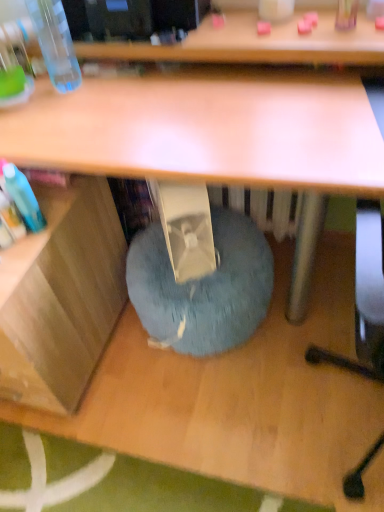
Question: Would you say transparent plastic bottle at upper left contains blue fuzzy bean bag at lower center?

Choices:
 (A) yes
 (B) no

Answer: (B)

Question: Is transparent plastic bottle at upper left positioned behind blue fuzzy bean bag at lower center?

Choices:
 (A) yes
 (B) no

Answer: (B)

Question: From a real-world perspective, is transparent plastic bottle at upper left over blue fuzzy bean bag at lower center?

Choices:
 (A) yes
 (B) no

Answer: (A)

Question: Is transparent plastic bottle at upper left positioned beyond the bounds of blue fuzzy bean bag at lower center?

Choices:
 (A) no
 (B) yes

Answer: (B)

Question: Is transparent plastic bottle at upper left placed right next to blue fuzzy bean bag at lower center?

Choices:
 (A) yes
 (B) no

Answer: (B)

Question: Is transparent plastic bottle at upper left spatially inside blue fuzzy bean bag at lower center, or outside of it?

Choices:
 (A) outside
 (B) inside

Answer: (A)

Question: In terms of height, does transparent plastic bottle at upper left look taller or shorter compared to blue fuzzy bean bag at lower center?

Choices:
 (A) tall
 (B) short

Answer: (A)

Question: From the image's perspective, is transparent plastic bottle at upper left located above or below blue fuzzy bean bag at lower center?

Choices:
 (A) below
 (B) above

Answer: (B)

Question: Does point (77, 65) appear closer or farther from the camera than point (180, 309)?

Choices:
 (A) closer
 (B) farther

Answer: (A)

Question: From a real-world perspective, is blue fuzzy bean bag at lower center positioned above or below wooden at left?

Choices:
 (A) below
 (B) above

Answer: (A)

Question: In terms of width, does blue fuzzy bean bag at lower center look wider or thinner when compared to wooden at left?

Choices:
 (A) wide
 (B) thin

Answer: (B)

Question: Based on their positions, is blue fuzzy bean bag at lower center located to the left or right of wooden at left?

Choices:
 (A) left
 (B) right

Answer: (B)

Question: Considering the positions of point (165, 295) and point (112, 224), is point (165, 295) closer or farther from the camera than point (112, 224)?

Choices:
 (A) closer
 (B) farther

Answer: (A)

Question: Is wooden at left inside the boundaries of transparent plastic bottle at upper left, or outside?

Choices:
 (A) inside
 (B) outside

Answer: (B)

Question: Considering the positions of wooden at left and transparent plastic bottle at upper left in the image, is wooden at left wider or thinner than transparent plastic bottle at upper left?

Choices:
 (A) thin
 (B) wide

Answer: (B)